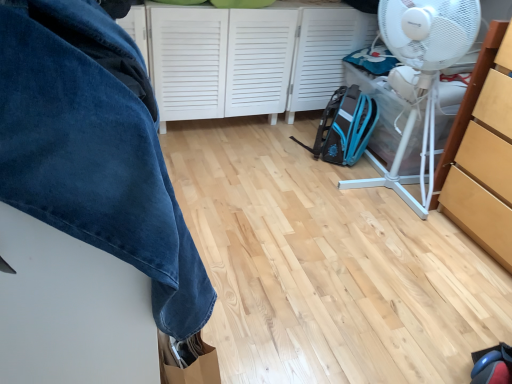
Question: From a real-world perspective, is white plastic mechanical fan at right beneath velvety blue blanket at upper left?

Choices:
 (A) yes
 (B) no

Answer: (B)

Question: Can you confirm if white plastic mechanical fan at right is taller than velvety blue blanket at upper left?

Choices:
 (A) no
 (B) yes

Answer: (B)

Question: From the image's perspective, is white plastic mechanical fan at right below velvety blue blanket at upper left?

Choices:
 (A) no
 (B) yes

Answer: (A)

Question: Is white plastic mechanical fan at right positioned far away from velvety blue blanket at upper left?

Choices:
 (A) no
 (B) yes

Answer: (B)

Question: Is white plastic mechanical fan at right not inside velvety blue blanket at upper left?

Choices:
 (A) yes
 (B) no

Answer: (A)

Question: Does white plastic mechanical fan at right have a larger size compared to velvety blue blanket at upper left?

Choices:
 (A) yes
 (B) no

Answer: (A)

Question: Is teal fabric backpack at center-right wider than white plastic mechanical fan at right?

Choices:
 (A) yes
 (B) no

Answer: (B)

Question: From a real-world perspective, is teal fabric backpack at center-right on top of white plastic mechanical fan at right?

Choices:
 (A) no
 (B) yes

Answer: (A)

Question: Can you confirm if teal fabric backpack at center-right is smaller than white plastic mechanical fan at right?

Choices:
 (A) yes
 (B) no

Answer: (A)

Question: Is teal fabric backpack at center-right shorter than white plastic mechanical fan at right?

Choices:
 (A) no
 (B) yes

Answer: (B)

Question: From the image's perspective, is teal fabric backpack at center-right on top of white plastic mechanical fan at right?

Choices:
 (A) yes
 (B) no

Answer: (B)

Question: Is the position of teal fabric backpack at center-right more distant than that of white plastic mechanical fan at right?

Choices:
 (A) no
 (B) yes

Answer: (B)

Question: Is white matte cabinet at center, placed as the second cabinetry when sorted from right to left, further to the viewer compared to velvety blue blanket at upper left?

Choices:
 (A) yes
 (B) no

Answer: (A)